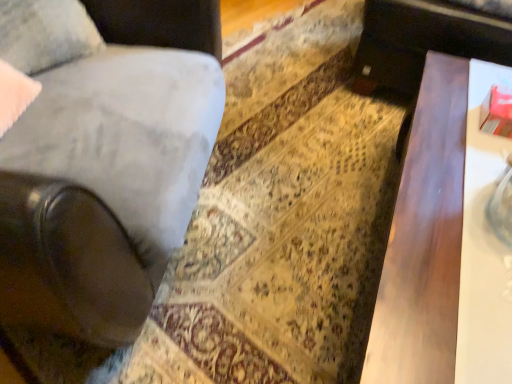
Image resolution: width=512 pixels, height=384 pixels. In order to click on suede-like gray chair at left in this screenshot , I will do `click(103, 188)`.

Identify the location of suede-like gray chair at left. (103, 188).

Locate an element on the screen. The image size is (512, 384). table on the right of velvet gray pillow at upper left is located at coordinates (424, 239).

Between dark wood table at right and velvet gray pillow at upper left, which one has less height?

velvet gray pillow at upper left is shorter.

Does dark wood table at right have a larger size compared to velvet gray pillow at upper left?

Yes.

Is dark wood table at right with velvet gray pillow at upper left?

dark wood table at right and velvet gray pillow at upper left are not in contact.

From a real-world perspective, is dark wood table at right physically located above or below suede-like gray chair at left?

Clearly, from a real-world perspective, dark wood table at right is below suede-like gray chair at left.

In the scene shown: Considering the sizes of objects dark wood table at right and suede-like gray chair at left in the image provided, who is taller, dark wood table at right or suede-like gray chair at left?

With more height is suede-like gray chair at left.

From the picture: Considering their positions, is dark wood table at right located in front of or behind suede-like gray chair at left?

Visually, dark wood table at right is located behind suede-like gray chair at left.

Image resolution: width=512 pixels, height=384 pixels. In order to click on table behind the suede-like gray chair at left in this screenshot , I will do `click(424, 239)`.

Does suede-like gray chair at left touch dark wood table at right?

No, suede-like gray chair at left is not making contact with dark wood table at right.

Looking at the image, does suede-like gray chair at left seem bigger or smaller compared to dark wood table at right?

Considering their sizes, suede-like gray chair at left takes up more space than dark wood table at right.

Is suede-like gray chair at left positioned with its back to dark wood table at right?

No.

Measure the distance from suede-like gray chair at left to dark wood table at right.

suede-like gray chair at left is 59.12 centimeters from dark wood table at right.

In the scene shown: From a real-world perspective, is velvet gray pillow at upper left located beneath dark wood table at right?

No.

Which of these two, velvet gray pillow at upper left or dark wood table at right, is thinner?

velvet gray pillow at upper left is thinner.

Can dark wood table at right be found inside velvet gray pillow at upper left?

No, dark wood table at right is not inside velvet gray pillow at upper left.

Locate an element on the screen. pillow located above the suede-like gray chair at left (from a real-world perspective) is located at coordinates (45, 33).

Based on the photo, does suede-like gray chair at left appear on the right side of velvet gray pillow at upper left?

Incorrect, suede-like gray chair at left is not on the right side of velvet gray pillow at upper left.

From the image's perspective, between suede-like gray chair at left and velvet gray pillow at upper left, which one is located above?

velvet gray pillow at upper left appears higher in the image.

Could you tell me if velvet gray pillow at upper left is facing suede-like gray chair at left?

Yes, velvet gray pillow at upper left is facing suede-like gray chair at left.

Is suede-like gray chair at left surrounded by velvet gray pillow at upper left?

Actually, suede-like gray chair at left is outside velvet gray pillow at upper left.

From a real-world perspective, between velvet gray pillow at upper left and suede-like gray chair at left, who is vertically lower?

In real-world perspective, suede-like gray chair at left is lower.

From the image's perspective, is velvet gray pillow at upper left on top of suede-like gray chair at left?

Yes, from the image's perspective, velvet gray pillow at upper left is over suede-like gray chair at left.

In the image, there is a velvet gray pillow at upper left. In order to click on table below it (from a real-world perspective) in this screenshot , I will do `click(424, 239)`.

Where is `chair above the dark wood table at right (from a real-world perspective)`? This screenshot has height=384, width=512. chair above the dark wood table at right (from a real-world perspective) is located at coordinates (103, 188).

Which object lies nearer to the anchor point dark wood table at right, suede-like gray chair at left or velvet gray pillow at upper left?

suede-like gray chair at left.

Looking at the image, which one is located closer to dark wood table at right, velvet gray pillow at upper left or suede-like gray chair at left?

suede-like gray chair at left.

Estimate the real-world distances between objects in this image. Which object is closer to suede-like gray chair at left, velvet gray pillow at upper left or dark wood table at right?

velvet gray pillow at upper left.

From the image, which object appears to be farther from velvet gray pillow at upper left, dark wood table at right or suede-like gray chair at left?

dark wood table at right is positioned further to the anchor velvet gray pillow at upper left.

When comparing their distances from velvet gray pillow at upper left, does suede-like gray chair at left or dark wood table at right seem further?

dark wood table at right lies further to velvet gray pillow at upper left than the other object.

When comparing their distances from suede-like gray chair at left, does dark wood table at right or velvet gray pillow at upper left seem closer?

Based on the image, velvet gray pillow at upper left appears to be nearer to suede-like gray chair at left.

This screenshot has height=384, width=512. What are the coordinates of `pillow situated between suede-like gray chair at left and dark wood table at right from left to right` in the screenshot? It's located at (45, 33).